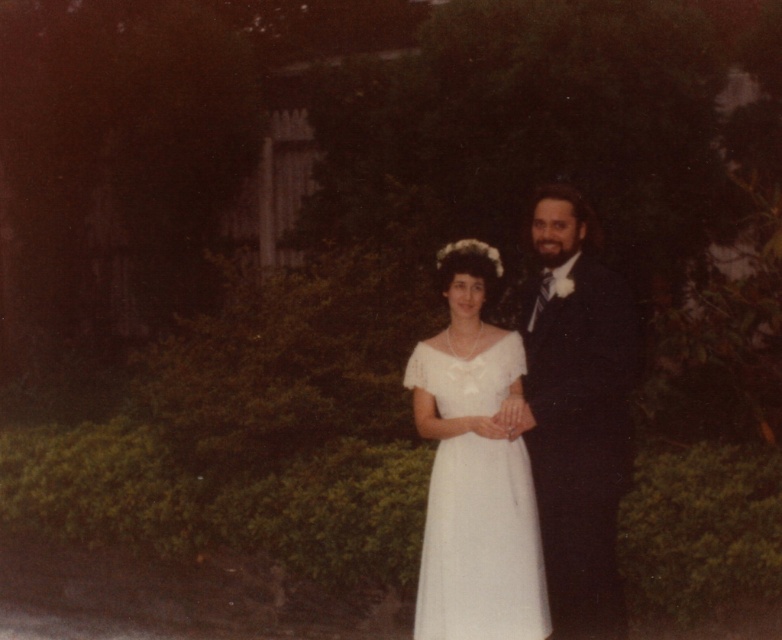
Question: Which of the following is the farthest from the observer?

Choices:
 (A) shiny black suit at right
 (B) white satin dress at center

Answer: (B)

Question: Which point is farther to the camera?

Choices:
 (A) [x=483, y=470]
 (B) [x=596, y=541]

Answer: (A)

Question: Does shiny black suit at right have a smaller size compared to white satin dress at center?

Choices:
 (A) yes
 (B) no

Answer: (B)

Question: Does shiny black suit at right have a larger size compared to white satin dress at center?

Choices:
 (A) yes
 (B) no

Answer: (A)

Question: Which object is closer to the camera taking this photo?

Choices:
 (A) white satin dress at center
 (B) shiny black suit at right

Answer: (B)

Question: Can you confirm if shiny black suit at right is thinner than white satin dress at center?

Choices:
 (A) yes
 (B) no

Answer: (A)